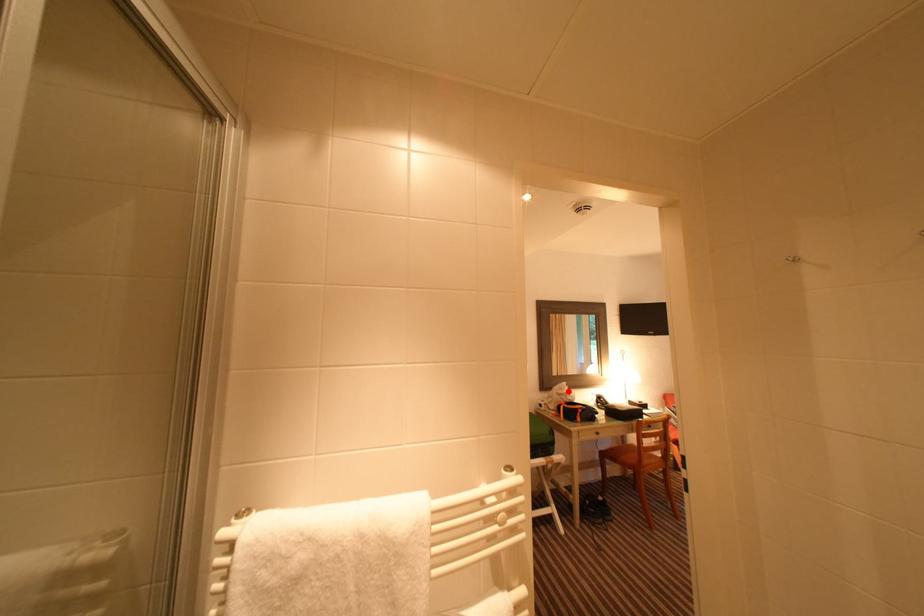
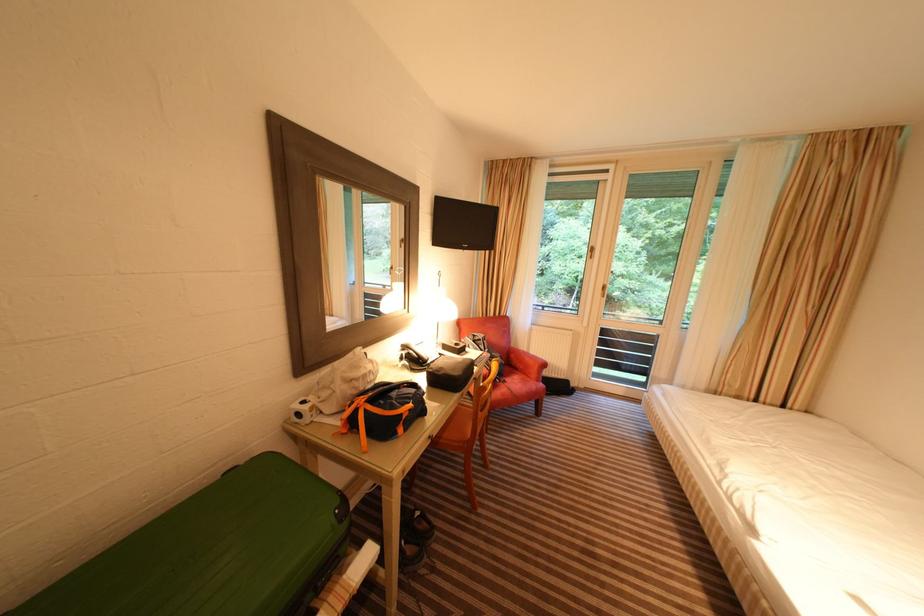
Where in the second image is the point corresponding to the highlighted location from the first image?

(361, 369)